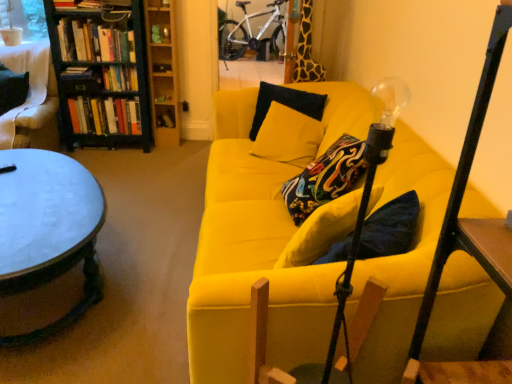
I want to click on free space to the right of black wood bookcase at left, which is the second bookcase from right to left, so click(x=176, y=153).